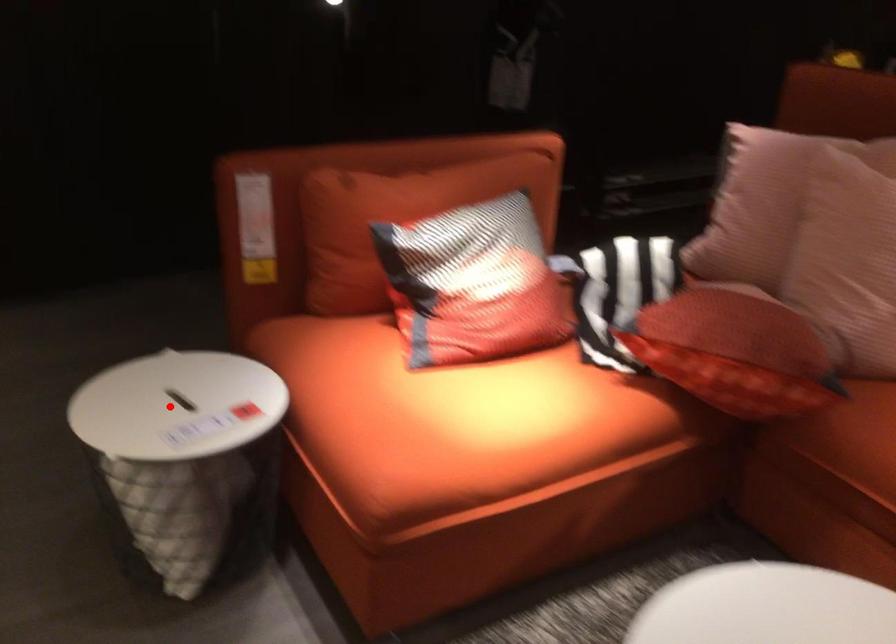
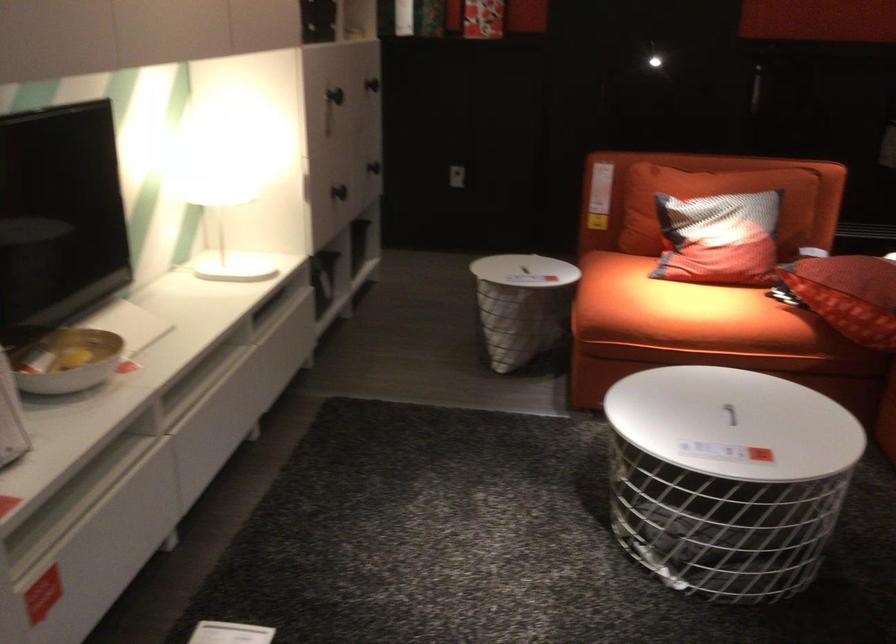
Question: I am providing you with two images of the same scene from different viewpoints. Image1 has a red point marked. In image2, the corresponding 3D location appears at what relative position? Reply with the corresponding letter.

Choices:
 (A) Closer
 (B) Farther

Answer: (B)